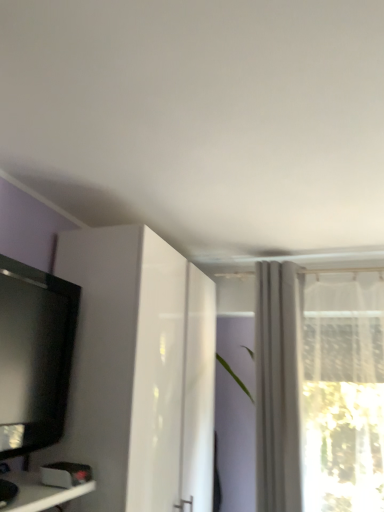
Question: Is white sheer curtain at upper right completely or partially inside white glossy cabinet at left?

Choices:
 (A) no
 (B) yes

Answer: (A)

Question: Does white glossy cabinet at left have a lesser width compared to white sheer curtain at upper right?

Choices:
 (A) no
 (B) yes

Answer: (A)

Question: Would you say white glossy cabinet at left is a long distance from white sheer curtain at upper right?

Choices:
 (A) yes
 (B) no

Answer: (B)

Question: From the image's perspective, is white glossy cabinet at left under white sheer curtain at upper right?

Choices:
 (A) yes
 (B) no

Answer: (A)

Question: Are white glossy cabinet at left and white sheer curtain at upper right making contact?

Choices:
 (A) no
 (B) yes

Answer: (A)

Question: Does white glossy cabinet at left appear on the right side of white sheer curtain at upper right?

Choices:
 (A) yes
 (B) no

Answer: (B)

Question: Considering the relative sizes of white sheer curtain at upper right and black glossy television at left in the image provided, is white sheer curtain at upper right shorter than black glossy television at left?

Choices:
 (A) yes
 (B) no

Answer: (B)

Question: Can you confirm if white sheer curtain at upper right is smaller than black glossy television at left?

Choices:
 (A) yes
 (B) no

Answer: (B)

Question: Is white sheer curtain at upper right wider than black glossy television at left?

Choices:
 (A) yes
 (B) no

Answer: (A)

Question: Is white sheer curtain at upper right next to black glossy television at left and touching it?

Choices:
 (A) yes
 (B) no

Answer: (B)

Question: Is white sheer curtain at upper right not inside black glossy television at left?

Choices:
 (A) yes
 (B) no

Answer: (A)

Question: Would you consider white sheer curtain at upper right to be distant from black glossy television at left?

Choices:
 (A) no
 (B) yes

Answer: (B)

Question: From the image's perspective, would you say black glossy television at left is positioned over white glossy cabinet at left?

Choices:
 (A) yes
 (B) no

Answer: (A)